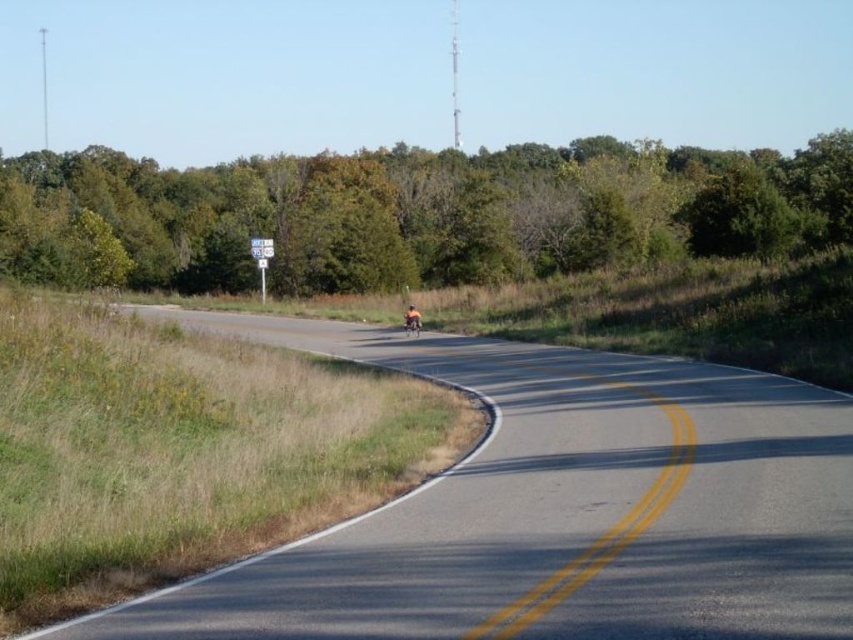
You are driving a car and see the green leafy trees at upper center and the orange fabric motorcyclist at center. Which object is closer to you?

The orange fabric motorcyclist at center is closer to you because the green leafy trees at upper center are further away.

You are a delivery driver planning to make a right turn onto the rural road shown. The orange fabric motorcyclist at center is in your path. Can you safely navigate around them while maintaining a 1.5 meter safety distance?

The orange fabric motorcyclist at center is positioned at point (x=412, y=317). To maintain a 1.5 meter safety distance, you should adjust your driving path to either side of the road, ensuring you pass at least 1.5 meters away from their position. Since the road curves gently to the right and has a double yellow line, you must stay on your side of the road while maneuvering around them.

In the scene shown: You are a cyclist approaching the rural road scene described. You notice an orange fabric motorcyclist at center and a shiny chrome motorbike at center. Which object is positioned higher in the image?

The orange fabric motorcyclist at center is located above the shiny chrome motorbike at center, so the orange fabric motorcyclist at center is higher in the image.